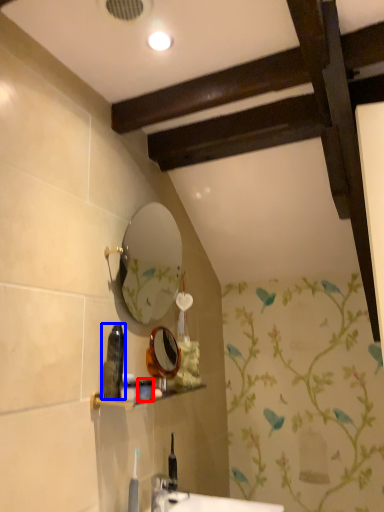
Question: Which of the following is the closest to the observer, toiletry (highlighted by a red box) or toiletry (highlighted by a blue box)?

Choices:
 (A) toiletry
 (B) toiletry

Answer: (B)